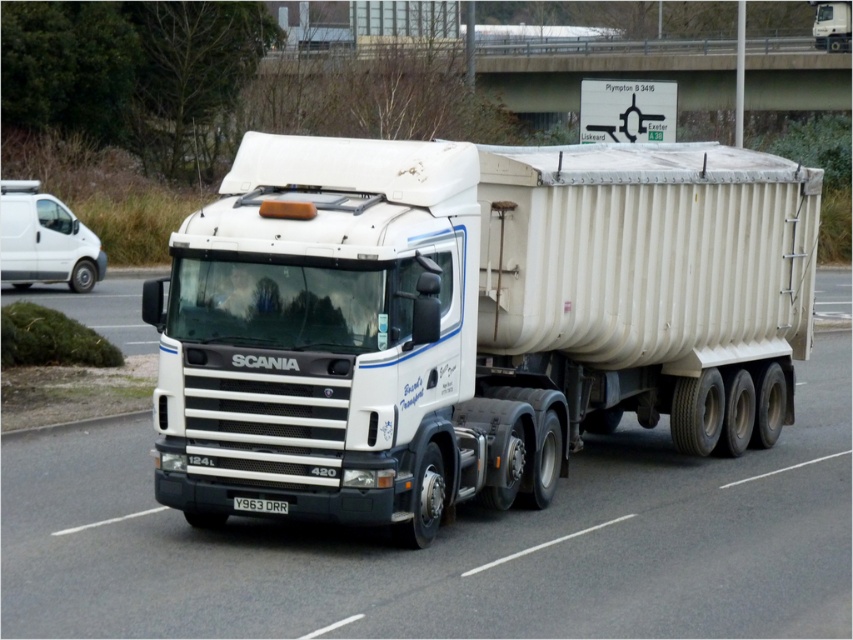
You are standing at point A located at coordinates 0.300, 0.600. You want to walk to the white matte truck at center. Which direction should you move relative to your current position?

You should move to the right and slightly downward relative to your current position at point A to reach the white matte truck at center.

You are a driver observing the white matte truck at center and the black plastic license plate at center from the front. Which object appears taller in the scene?

The black plastic license plate at center appears taller than the white matte truck at center because the white matte truck at center is shorter than the black plastic license plate at center.